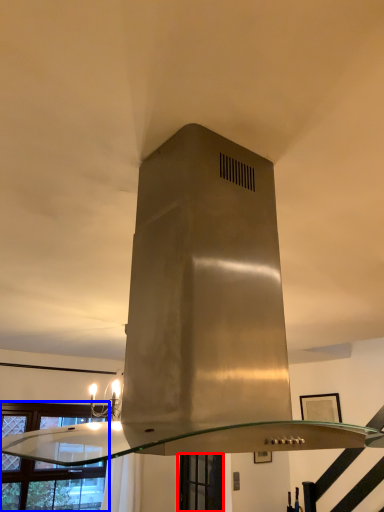
Question: Which of the following is the closest to the observer, window (highlighted by a red box) or window (highlighted by a blue box)?

Choices:
 (A) window
 (B) window

Answer: (B)